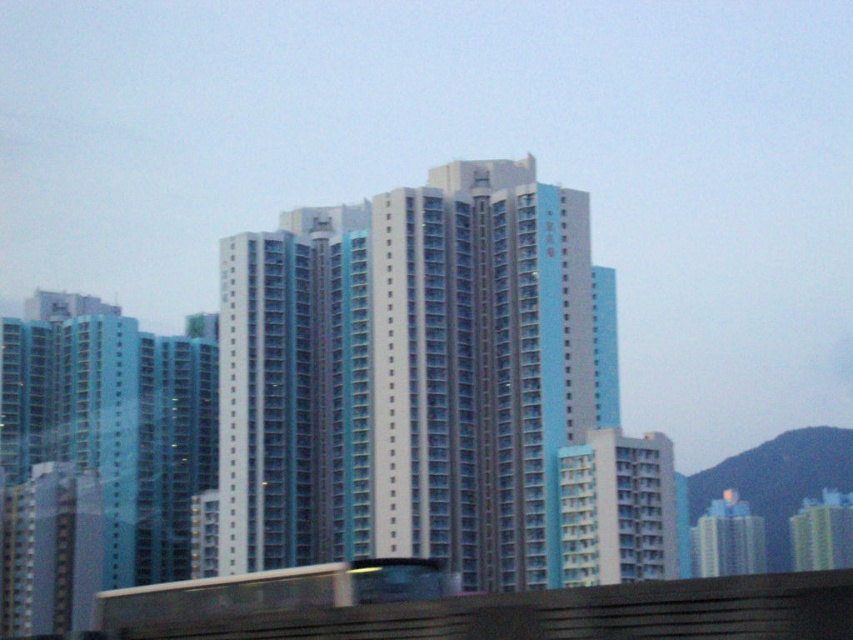
Question: Does white glass building at center appear over concrete platform at lower center?

Choices:
 (A) no
 (B) yes

Answer: (B)

Question: In this image, where is white glass building at center located relative to concrete platform at lower center?

Choices:
 (A) left
 (B) right

Answer: (A)

Question: Does white glass building at center have a lesser width compared to concrete platform at lower center?

Choices:
 (A) yes
 (B) no

Answer: (B)

Question: Which point is farther from the camera taking this photo?

Choices:
 (A) (386, 618)
 (B) (583, 396)

Answer: (B)